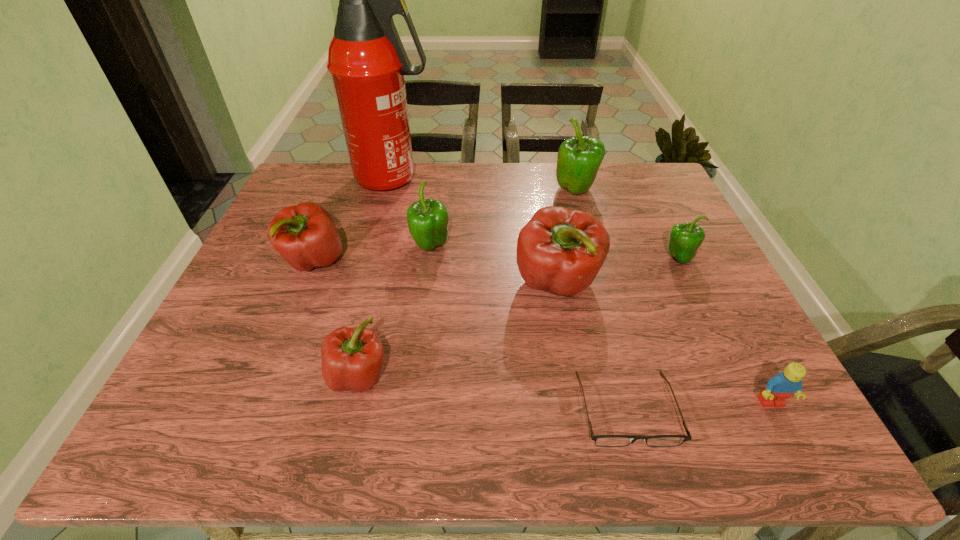
Select which green bell pepper is the second closest to the second pink bell pepper from right to left. Please provide its 2D coordinates. Your answer should be formatted as a tuple, i.e. [(x, y)], where the tuple contains the x and y coordinates of a point satisfying the conditions above.

[(578, 161)]

Locate an element on the screen. the second closest green bell pepper to the second pink bell pepper from left to right is located at coordinates (578, 161).

Locate which pink bell pepper ranks in proximity to the leftmost bell pepper. Please provide its 2D coordinates. Your answer should be formatted as a tuple, i.e. [(x, y)], where the tuple contains the x and y coordinates of a point satisfying the conditions above.

[(352, 358)]

Image resolution: width=960 pixels, height=540 pixels. Identify the location of the closest pink bell pepper to the farthest green bell pepper. (559, 250).

What are the coordinates of `free space that satisfies the following two spatial constraints: 1. on the back side of the rightmost green bell pepper; 2. on the left side of the rightmost pink bell pepper` in the screenshot? It's located at (553, 258).